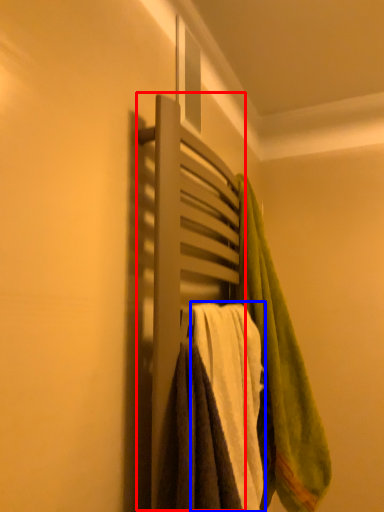
Question: Among these objects, which one is farthest to the camera, closet (highlighted by a red box) or towel (highlighted by a blue box)?

Choices:
 (A) closet
 (B) towel

Answer: (B)